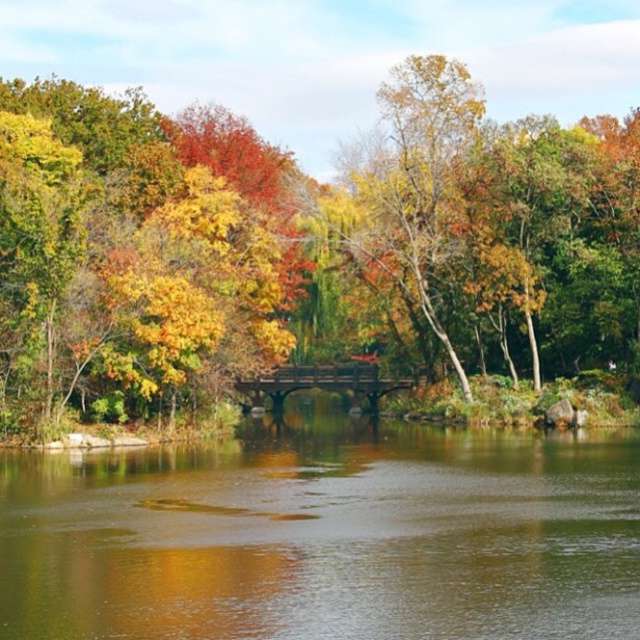
You are standing at the point indicated by point (301, 248) in the image. Looking around, you see a yellow matte tree at center. What is the nearest object to your current position?

The nearest object to your current position at point (301, 248) is the yellow matte tree at center since you are standing right at the point indicating its location.

You are an artist planning to paint the autumn scene. You want to ensure the yellow matte tree at center and the green reflective water at center are proportionally accurate. Which object should you paint larger in your artwork?

The yellow matte tree at center should be painted larger than the green reflective water at center because the description states that the yellow matte tree at center is bigger than the green reflective water at center.

You are standing on the rustic wooden bridge and want to place a small wooden bench between the yellow matte tree at center and the green reflective water at center. Based on their widths, which object should the bench be placed closer to?

The yellow matte tree at center might be wider than green reflective water at center, so the bench should be placed closer to the yellow matte tree at center to accommodate its width.